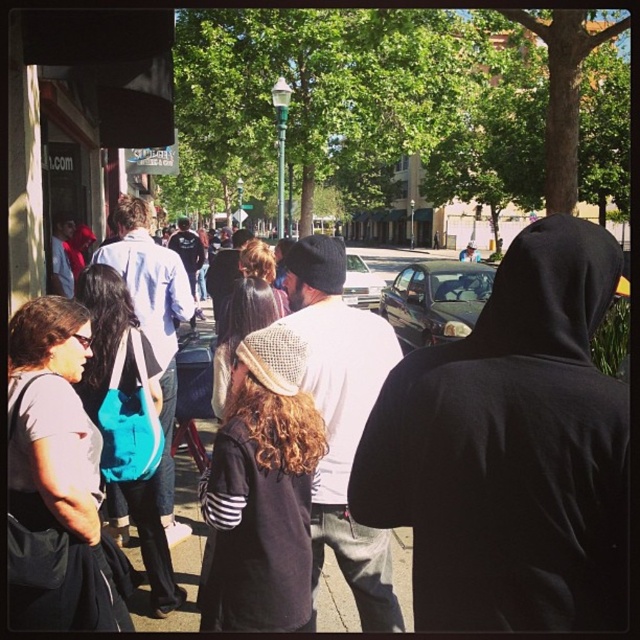
Can you confirm if dark brown knit cap at center is thinner than shiny black sedan at center?

Yes, dark brown knit cap at center is thinner than shiny black sedan at center.

Find the location of `dark brown knit cap at center`. dark brown knit cap at center is located at coordinates (262, 492).

Where is `dark brown knit cap at center`? The image size is (640, 640). dark brown knit cap at center is located at coordinates (262, 492).

Between shiny black sedan at center and silver metallic sedan at center, which one is positioned lower?

shiny black sedan at center is below.

Is shiny black sedan at center closer to camera compared to silver metallic sedan at center?

No, shiny black sedan at center is further to the viewer.

In order to click on shiny black sedan at center in this screenshot , I will do click(x=435, y=300).

Does dark brown knit cap at center appear under silver metallic sedan at center?

Yes.

Which is in front, point (275, 346) or point (362, 300)?

Point (275, 346) is in front.

The width and height of the screenshot is (640, 640). Identify the location of dark brown knit cap at center. (262, 492).